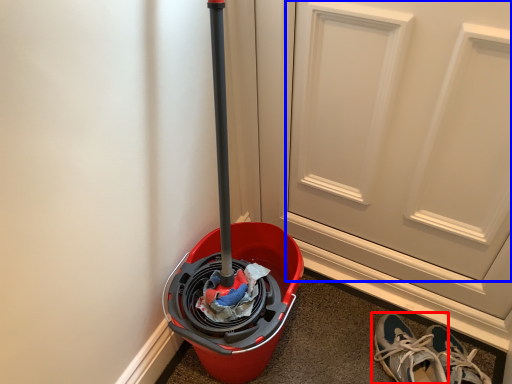
Question: Which object is closer to the camera taking this photo, footwear (highlighted by a red box) or door (highlighted by a blue box)?

Choices:
 (A) footwear
 (B) door

Answer: (B)